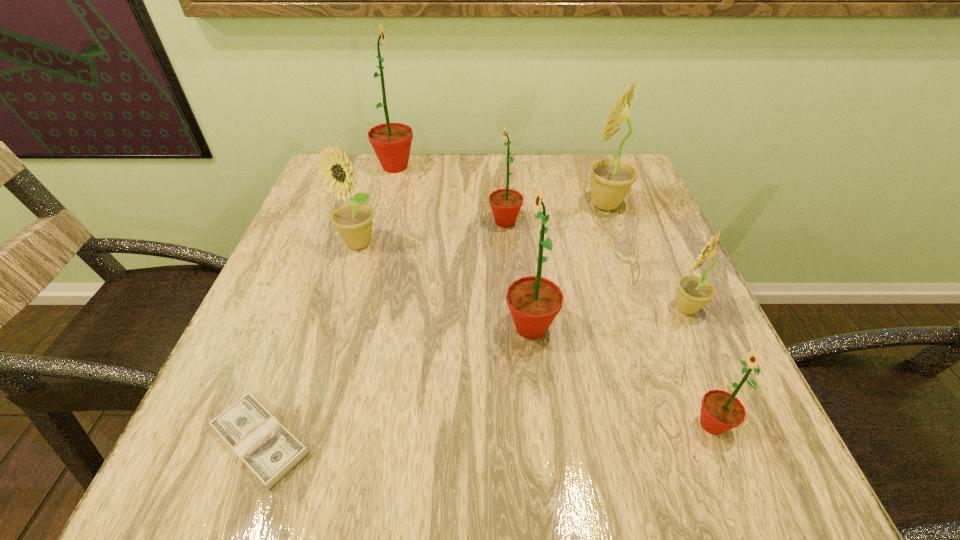
Where is `dollar`? dollar is located at coordinates (270, 451).

You are a GUI agent. You are given a task and a screenshot of the screen. Output one action in this format:
    pyautogui.click(x=<x>, y=<y>)
    Task: Click on the free space located 0.210m on the face of the tallest sunflower
    
    Given the screenshot: What is the action you would take?
    pyautogui.click(x=492, y=167)

Where is `vacant space located 0.180m on the face of the farthest yellow sunflower`? The width and height of the screenshot is (960, 540). vacant space located 0.180m on the face of the farthest yellow sunflower is located at coordinates (509, 205).

Where is `vacant space situated 0.380m on the face of the farthest yellow sunflower`? vacant space situated 0.380m on the face of the farthest yellow sunflower is located at coordinates (427, 205).

At what (x,y) coordinates should I click in order to perform the action: click on vacant region located 0.100m on the face of the farthest yellow sunflower. Please return your answer as a coordinate pair (x, y). Looking at the image, I should click on (540, 205).

Identify the location of free space located on the face of the third smallest green sunflower. (285, 327).

Where is `vacant space situated 0.220m on the face of the third smallest green sunflower`? The width and height of the screenshot is (960, 540). vacant space situated 0.220m on the face of the third smallest green sunflower is located at coordinates (384, 327).

Identify the location of vacant region located 0.270m on the face of the third smallest green sunflower. (356, 327).

The width and height of the screenshot is (960, 540). What are the coordinates of `free location located on the face of the third nearest green sunflower` in the screenshot? It's located at (x=454, y=222).

The height and width of the screenshot is (540, 960). I want to click on free spot located 0.250m on the face of the third nearest green sunflower, so click(382, 222).